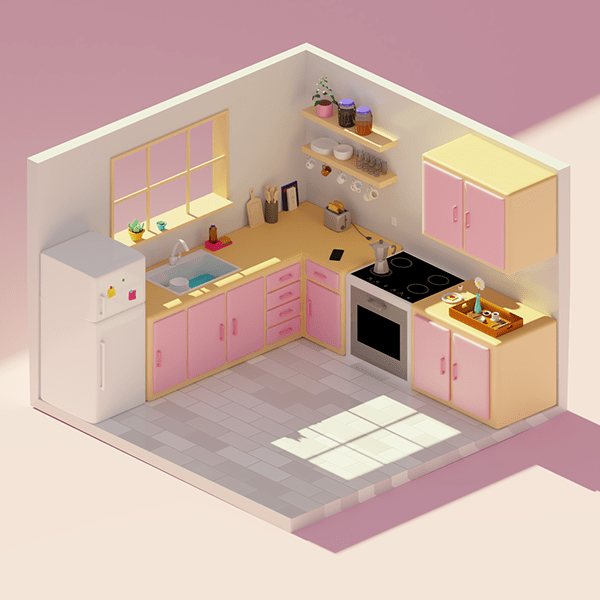
Locate an element on the screen. The image size is (600, 600). freezer door is located at coordinates (115, 305).